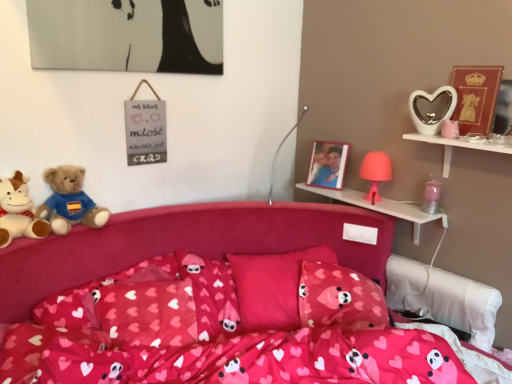
The width and height of the screenshot is (512, 384). Find the location of `blank area to the left of matte pink lamp at upper right, placed as the third toy when sorted from top to bottom`. blank area to the left of matte pink lamp at upper right, placed as the third toy when sorted from top to bottom is located at coordinates (346, 196).